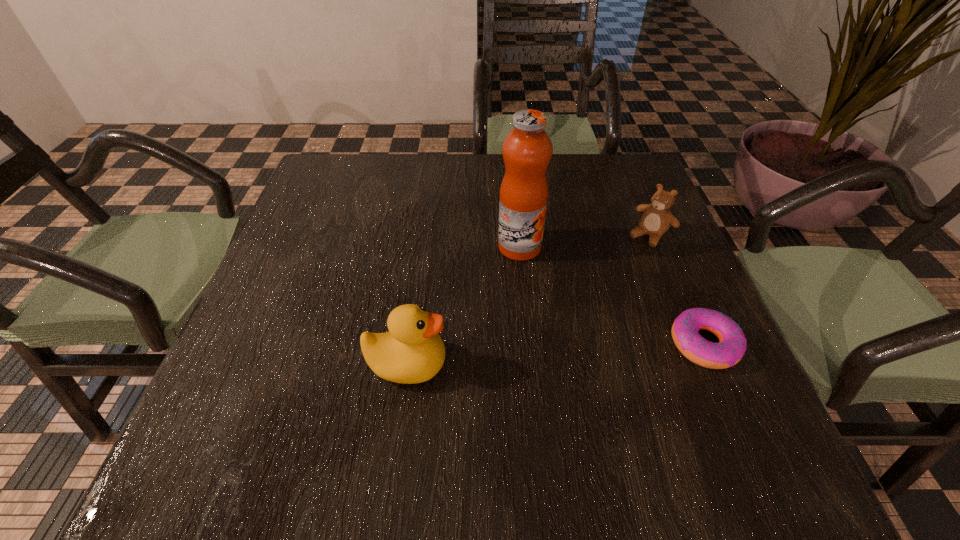
Where is `free space on the desktop that is between the third shortest object and the shortest object and is positioned on the front label of the second object from left to right`? The image size is (960, 540). free space on the desktop that is between the third shortest object and the shortest object and is positioned on the front label of the second object from left to right is located at coordinates (587, 352).

At what (x,y) coordinates should I click in order to perform the action: click on vacant space on the desktop that is between the leftmost object and the doughnut and is positioned on the front-facing side of the third tallest object. Please return your answer as a coordinate pair (x, y). This screenshot has width=960, height=540. Looking at the image, I should click on (536, 355).